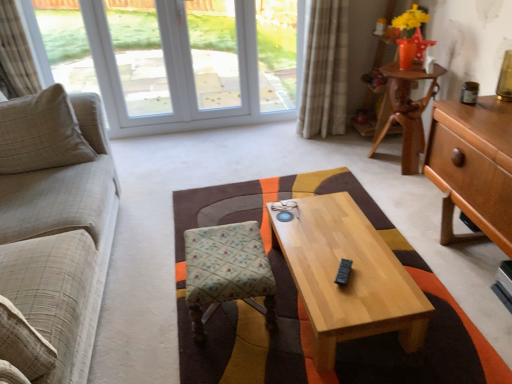
At what (x,y) coordinates should I click in order to perform the action: click on vacant area on the back side of light wood/texture coffee table at center. Please return your answer as a coordinate pair (x, y). Looking at the image, I should click on (317, 192).